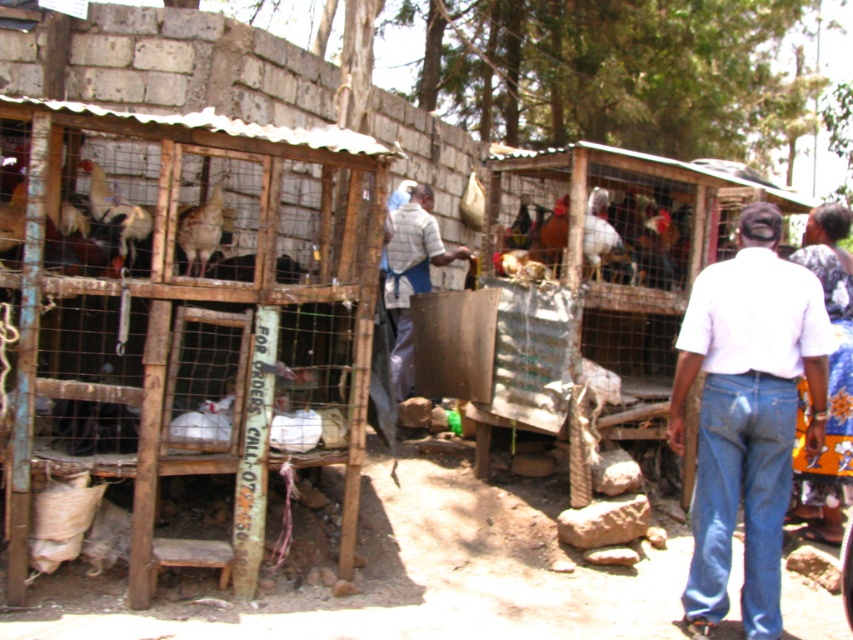
You are standing at the entrance of the poultry market and want to walk towards the first point you see. Which point, point (757, 300) or point (403, 268), would you reach first?

Point (757, 300) is in front of point (403, 268), so you would reach point (757, 300) first.

You are a customer at the poultry market and need to locate the vendor. Where is the vendor standing in relation to the white cotton shirt at center?

The vendor is standing at the white cotton shirt at center, as that is where the vendor is located according to the coordinates provided.